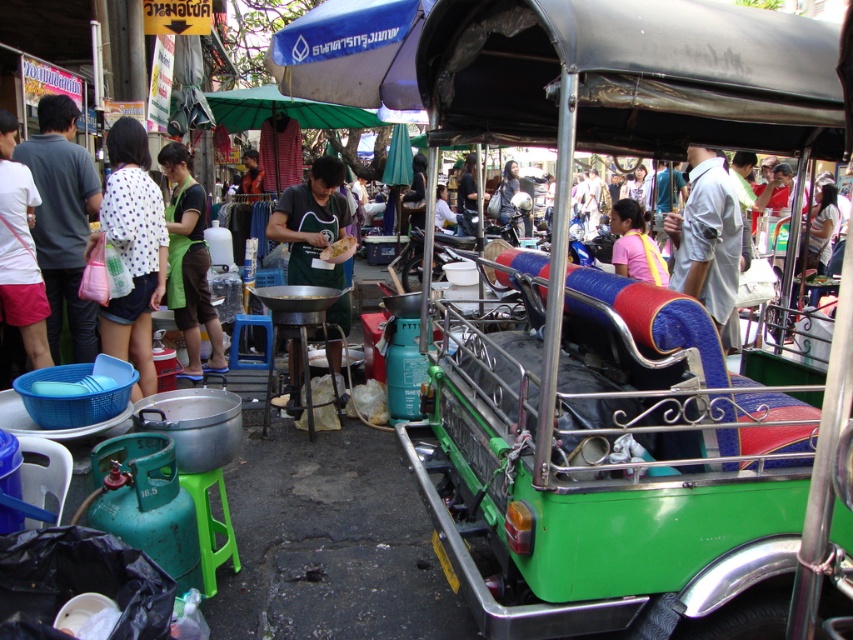
In the scene shown: You are a delivery person who needs to place a fragile package between the green matte apron at center and the pink fabric bag at center. Which object should you move to make space?

The green matte apron at center is wider than the pink fabric bag at center, so you should move the pink fabric bag at center to create more space for the package.

You are a delivery person who needs to carry both the white dotted shirt at left and the pink fabric bag at center. Which item can you fit through a narrow doorway that only allows items less than 10 cm thick?

The white dotted shirt at left is thinner than the pink fabric bag at center, so it can fit through the narrow doorway.